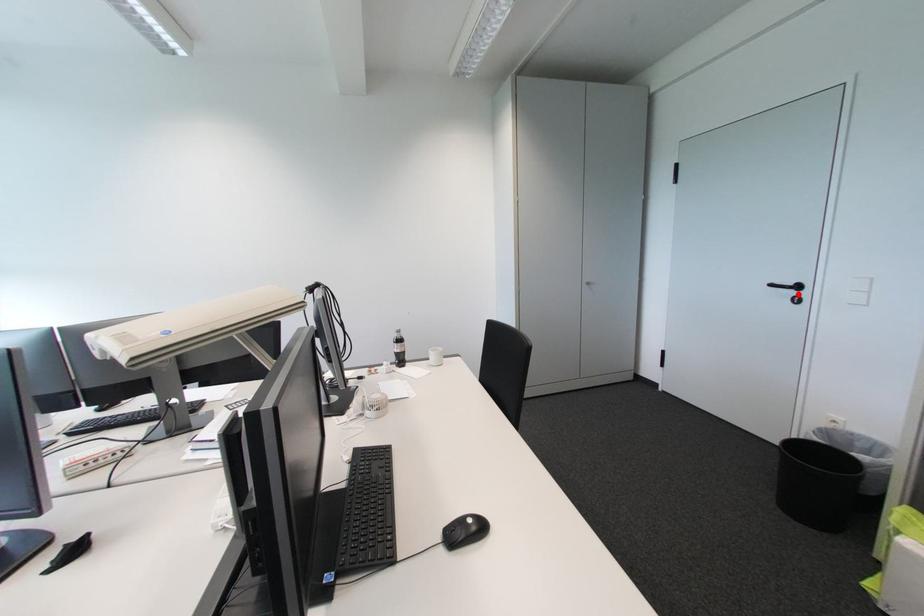
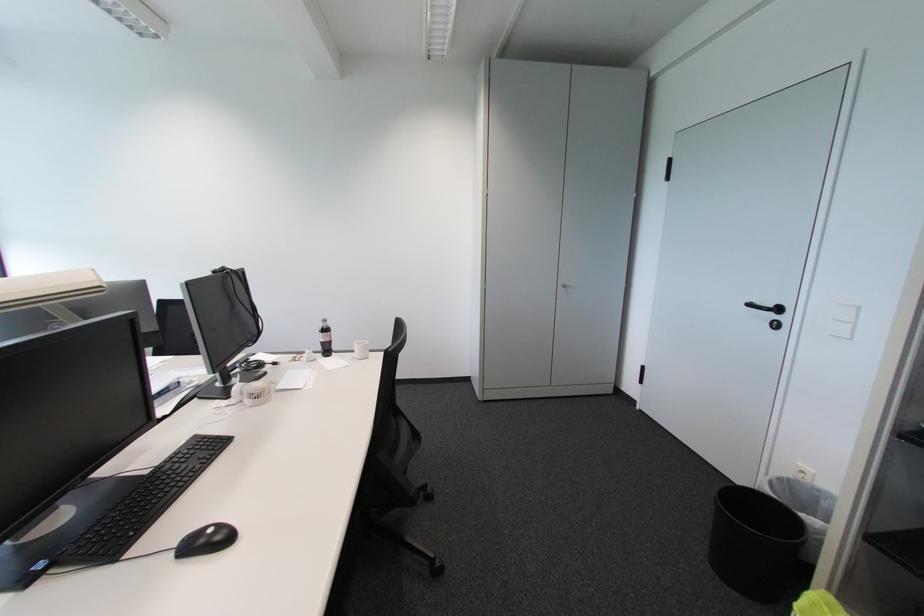
Where in the second image is the point corresponding to the highlighted location from the first image?

(777, 317)